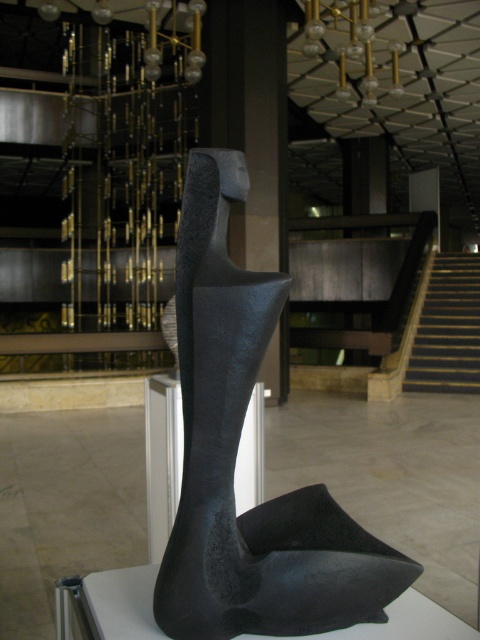
Can you confirm if matte black sculpture at center is positioned to the right of dark brown wooden stairs at right?

No, matte black sculpture at center is not to the right of dark brown wooden stairs at right.

Is point (223, 538) positioned before point (472, 310)?

Yes, it is.

Locate an element on the screen. This screenshot has height=640, width=480. matte black sculpture at center is located at coordinates (236, 456).